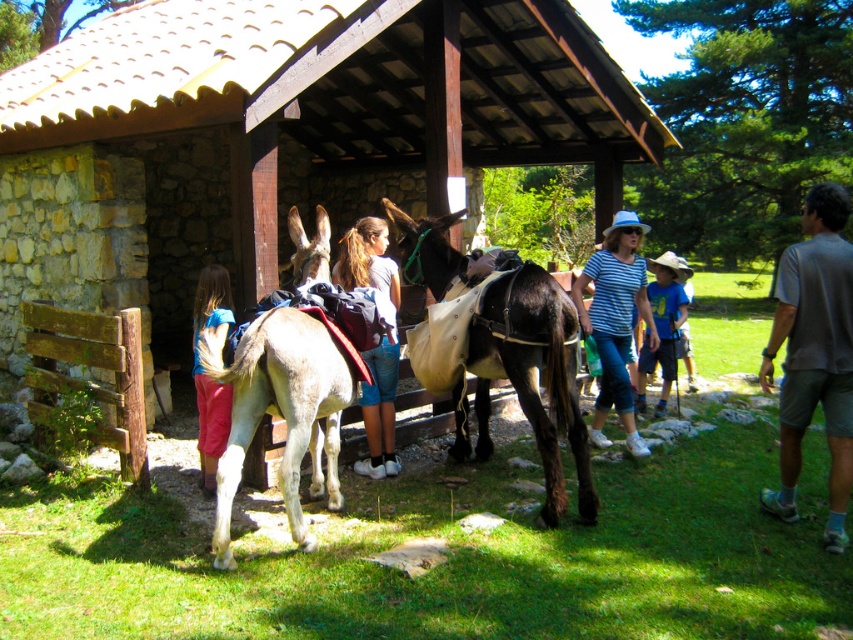
You are standing at the entrance of the rustic stone shelter and notice a gray fabric shirt at right. Based on its position, where exactly is the gray fabric shirt located in relation to the entrance?

The gray fabric shirt at right is located at coordinates approximately 55.5 percent from the left edge and 95.5 percent from the top edge of the image, placing it near the lower right corner relative to the entrance.